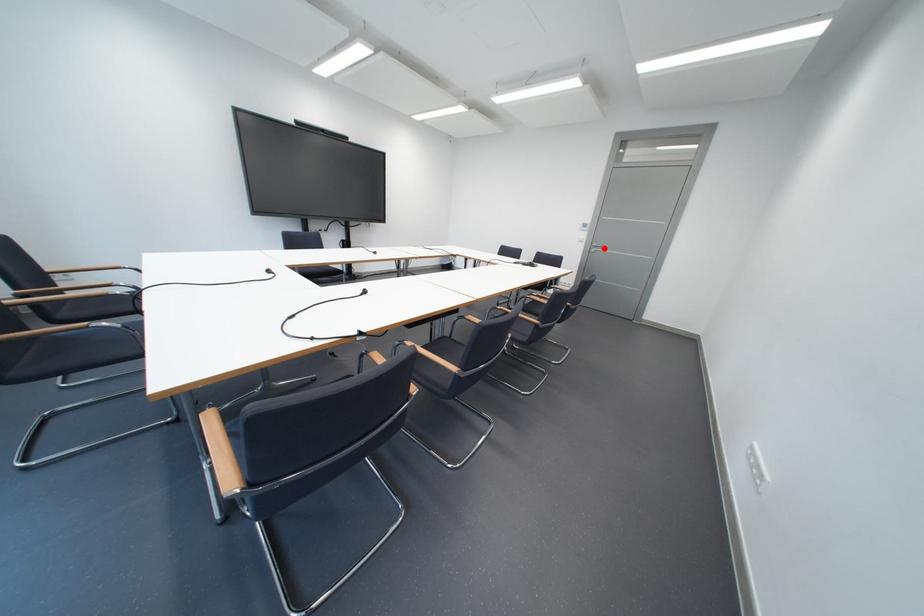
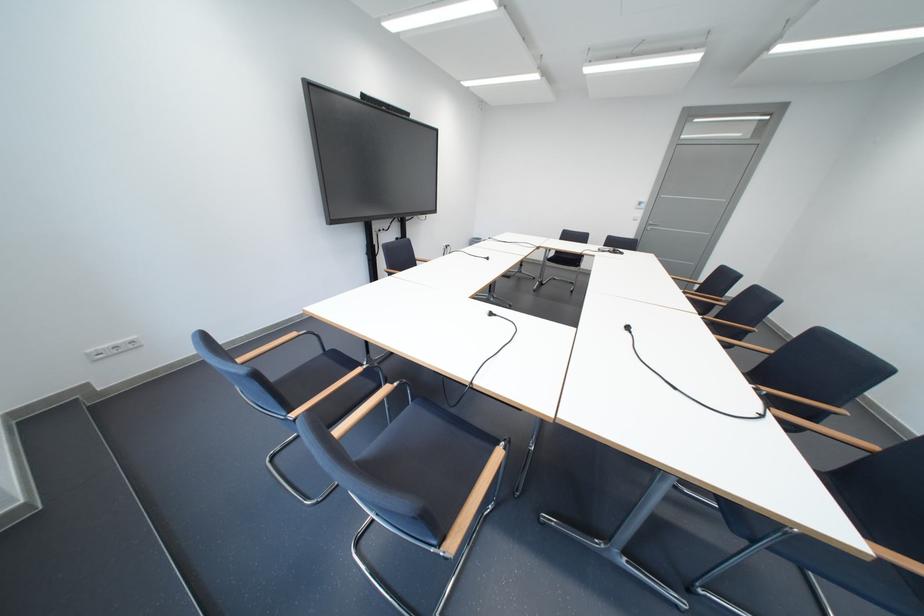
The point at the highlighted location is marked in the first image. Where is the corresponding point in the second image?

(660, 227)